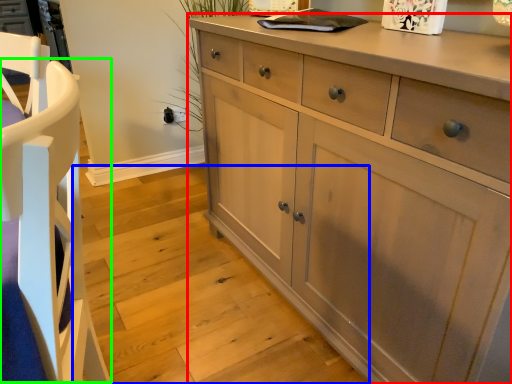
Question: Estimate the real-world distances between objects in this image. Which object is closer to chest of drawers (highlighted by a red box), stair (highlighted by a blue box) or armchair (highlighted by a green box)?

Choices:
 (A) stair
 (B) armchair

Answer: (A)